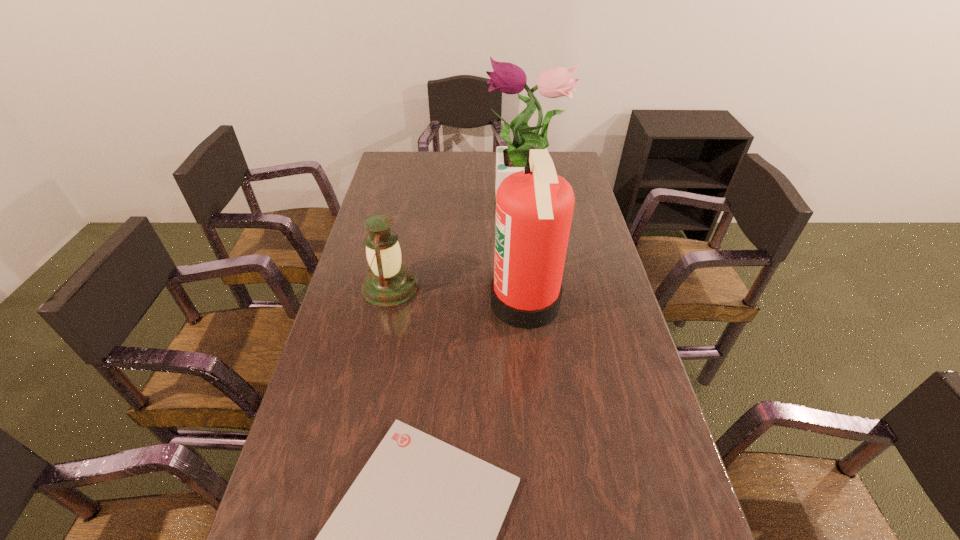
I want to click on object that is at the left edge, so click(388, 284).

Identify the location of object that is at the right edge. (508, 78).

The width and height of the screenshot is (960, 540). In order to click on free space at the far edge of the desktop in this screenshot , I will do `click(421, 177)`.

Locate an element on the screen. The image size is (960, 540). free space at the left edge is located at coordinates (415, 184).

The image size is (960, 540). I want to click on free space at the right edge of the desktop, so click(641, 414).

This screenshot has height=540, width=960. I want to click on vacant area at the far right corner of the desktop, so click(555, 161).

This screenshot has width=960, height=540. Identify the location of empty space between the fire extinguisher and the second shortest object. (458, 295).

Locate an element on the screen. The image size is (960, 540). empty location between the fire extinguisher and the lantern is located at coordinates (458, 295).

I want to click on empty space that is in between the third tallest object and the flower arrangement, so click(457, 246).

Find the location of a particular element. the closest object to the third tallest object is located at coordinates (534, 207).